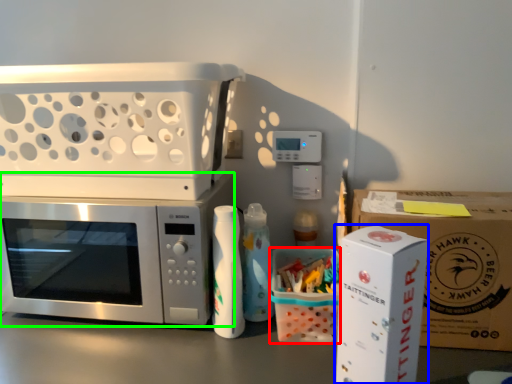
Question: Based on their relative distances, which object is farther from cardboard box (highlighted by a red box)? Choose from appliance (highlighted by a blue box) and microwave oven (highlighted by a green box).

Choices:
 (A) appliance
 (B) microwave oven

Answer: (B)